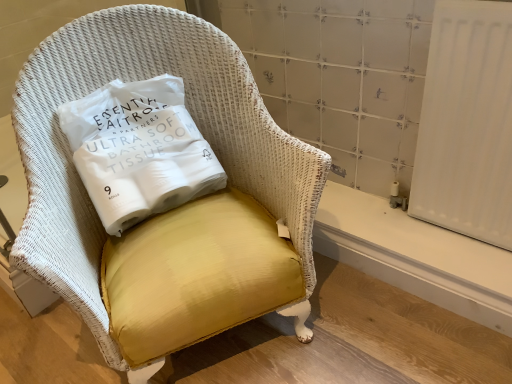
Question: Is white smooth radiator at lower right at the left side of yellow fabric pillow at center?

Choices:
 (A) yes
 (B) no

Answer: (B)

Question: Is white smooth radiator at lower right facing away from yellow fabric pillow at center?

Choices:
 (A) no
 (B) yes

Answer: (A)

Question: From the image's perspective, is white smooth radiator at lower right located beneath yellow fabric pillow at center?

Choices:
 (A) no
 (B) yes

Answer: (B)

Question: From a real-world perspective, is white smooth radiator at lower right beneath yellow fabric pillow at center?

Choices:
 (A) yes
 (B) no

Answer: (A)

Question: Is white smooth radiator at lower right smaller than yellow fabric pillow at center?

Choices:
 (A) no
 (B) yes

Answer: (B)

Question: Is point (250, 104) closer or farther from the camera than point (102, 89)?

Choices:
 (A) farther
 (B) closer

Answer: (B)

Question: Would you say yellow fabric chair at center is inside or outside yellow fabric pillow at center?

Choices:
 (A) inside
 (B) outside

Answer: (B)

Question: Considering their positions, is yellow fabric chair at center located in front of or behind yellow fabric pillow at center?

Choices:
 (A) front
 (B) behind

Answer: (A)

Question: From a real-world perspective, relative to yellow fabric pillow at center, is yellow fabric chair at center vertically above or below?

Choices:
 (A) below
 (B) above

Answer: (A)

Question: From their relative heights in the image, would you say white smooth radiator at lower right is taller or shorter than yellow fabric chair at center?

Choices:
 (A) short
 (B) tall

Answer: (A)

Question: From the image's perspective, is white smooth radiator at lower right positioned above or below yellow fabric chair at center?

Choices:
 (A) below
 (B) above

Answer: (A)

Question: Considering the positions of point (316, 231) and point (133, 375), is point (316, 231) closer or farther from the camera than point (133, 375)?

Choices:
 (A) closer
 (B) farther

Answer: (B)

Question: Choose the correct answer: Is white smooth radiator at lower right inside yellow fabric chair at center or outside it?

Choices:
 (A) inside
 (B) outside

Answer: (B)

Question: In terms of width, does white smooth radiator at lower right look wider or thinner when compared to yellow fabric pillow at center?

Choices:
 (A) thin
 (B) wide

Answer: (A)

Question: From their relative heights in the image, would you say white smooth radiator at lower right is taller or shorter than yellow fabric pillow at center?

Choices:
 (A) short
 (B) tall

Answer: (A)